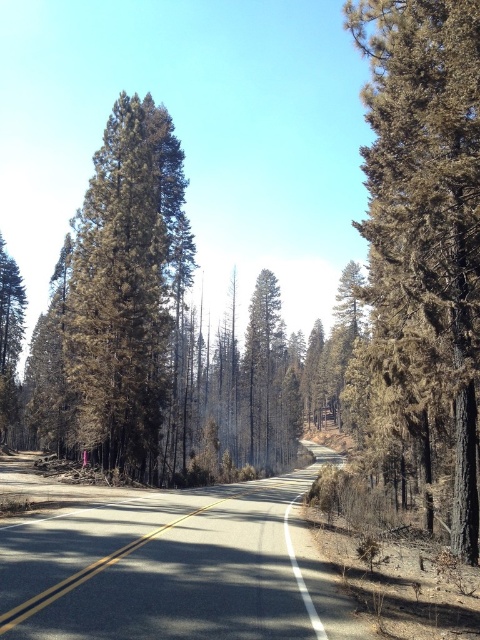
Which of these two, charred bark tree at center or asphalt road at center, stands taller?

With more height is charred bark tree at center.

Who is more distant from viewer, (468, 54) or (40, 541)?

The point (468, 54) is more distant.

Between point (441, 250) and point (19, 529), which one is positioned in front?

Point (19, 529) is in front.

Locate an element on the screen. This screenshot has height=640, width=480. charred bark tree at center is located at coordinates (425, 212).

Where is `asphalt road at center`? Image resolution: width=480 pixels, height=640 pixels. asphalt road at center is located at coordinates (176, 568).

Between asphalt road at center and brown textured tree at center, which one has more height?

Standing taller between the two is brown textured tree at center.

Between point (322, 454) and point (288, 433), which one is positioned behind?

Positioned behind is point (322, 454).

This screenshot has height=640, width=480. In order to click on asphalt road at center in this screenshot , I will do `click(176, 568)`.

Which is below, charred bark tree at center or brown textured tree at center?

brown textured tree at center is lower down.

Where is `charred bark tree at center`? charred bark tree at center is located at coordinates (425, 212).

Where is `charred bark tree at center`? The height and width of the screenshot is (640, 480). charred bark tree at center is located at coordinates (425, 212).